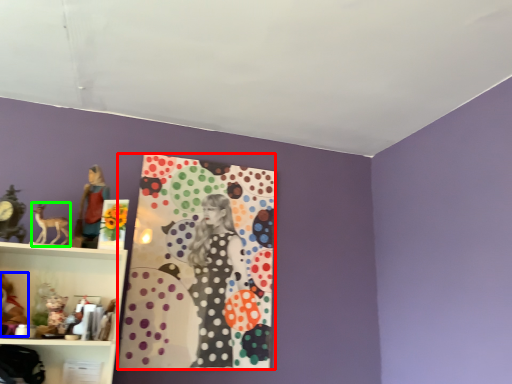
Question: Which object is positioned farthest from design (highlighted by a red box)? Select from toy (highlighted by a blue box) and animal (highlighted by a green box).

Choices:
 (A) toy
 (B) animal

Answer: (A)